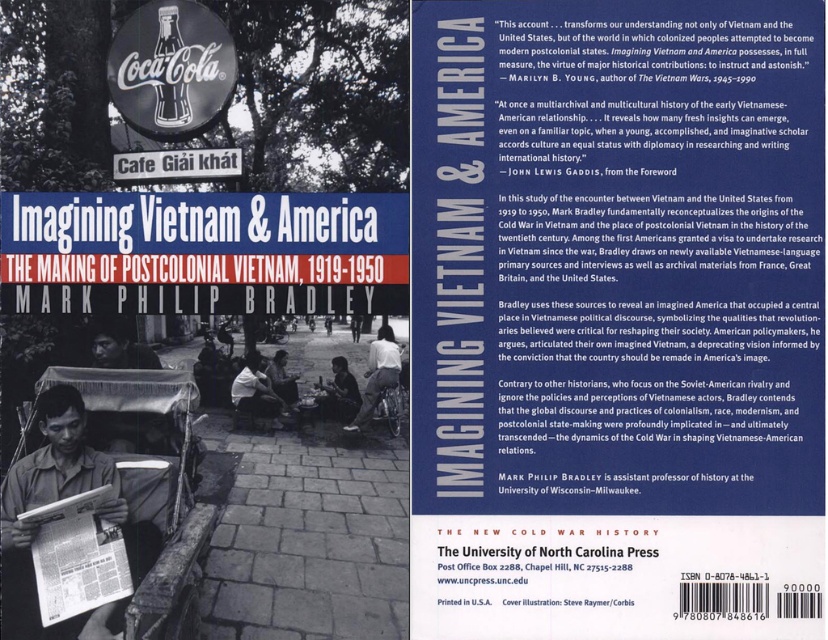
Question: Which of these objects is positioned farthest from the dark blue shirt at center?

Choices:
 (A) light brown wooden chair at center
 (B) white paper magazine at center
 (C) dark gray fabric skirt at center

Answer: (B)

Question: Is dark gray fabric skirt at center to the right of light brown wooden chair at center from the viewer's perspective?

Choices:
 (A) yes
 (B) no

Answer: (A)

Question: Which object appears farthest from the camera in this image?

Choices:
 (A) dark blue shirt at center
 (B) light brown wooden chair at center

Answer: (A)

Question: Which point is closer to the camera?

Choices:
 (A) (130, 576)
 (B) (384, 380)
 (C) (249, 381)

Answer: (A)

Question: Does dark brown leather bag at center have a lesser width compared to dark blue shirt at center?

Choices:
 (A) no
 (B) yes

Answer: (A)

Question: From the image, what is the correct spatial relationship of white paper magazine at center in relation to dark blue shirt at center?

Choices:
 (A) above
 (B) below

Answer: (B)